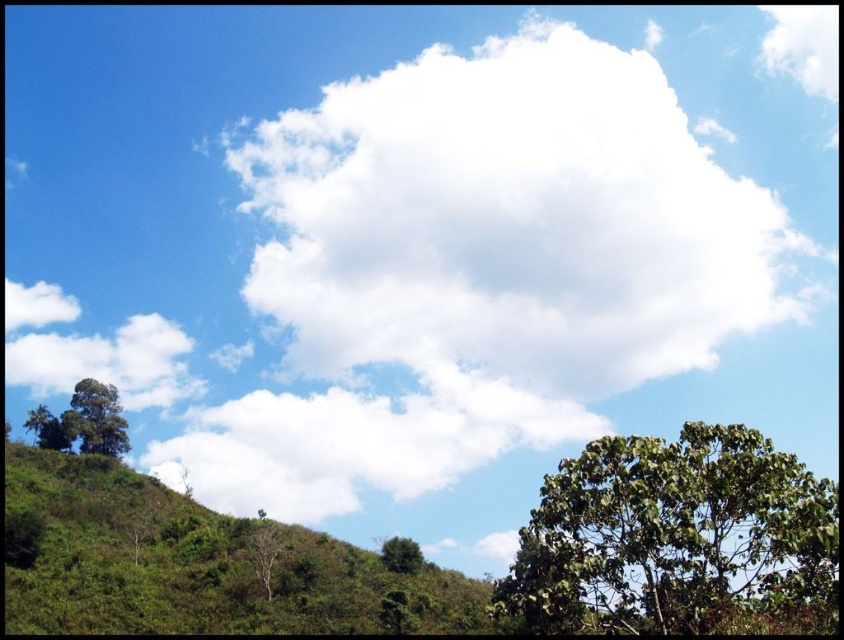
Question: Which object is positioned farthest from the white fluffy cloud at center?

Choices:
 (A) green leafy tree at lower right
 (B) green matte tree at lower left
 (C) green leafy tree at lower left
 (D) green leafy hillside at lower left

Answer: (A)

Question: In this image, where is white fluffy cloud at upper center located relative to green leafy tree at center?

Choices:
 (A) right
 (B) left

Answer: (A)

Question: Does green matte tree at lower left appear over green leafy tree at lower center?

Choices:
 (A) yes
 (B) no

Answer: (A)

Question: Based on their relative distances, which object is farther from the green matte tree at lower left?

Choices:
 (A) green leafy tree at center
 (B) white fluffy cloud at center
 (C) green leafy tree at lower right

Answer: (C)

Question: Does white fluffy cloud at center appear under green leafy tree at center?

Choices:
 (A) no
 (B) yes

Answer: (A)

Question: Among these objects, which one is nearest to the camera?

Choices:
 (A) green leafy tree at lower center
 (B) white fluffy cloud at center
 (C) green leafy tree at lower left
 (D) green matte tree at lower left

Answer: (A)